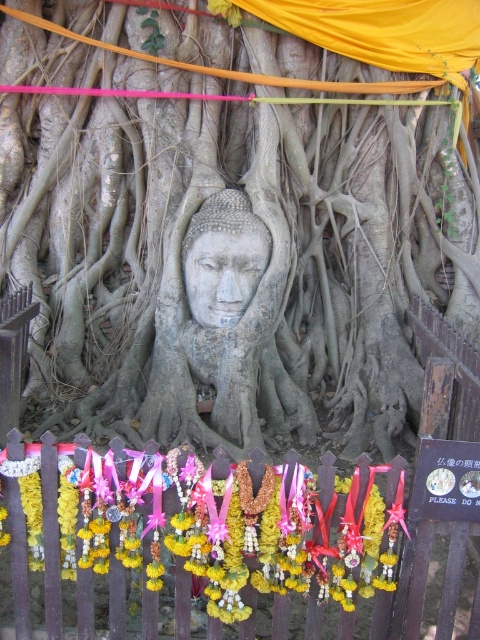
Describe the element at coordinates (180, 540) in the screenshot. The height and width of the screenshot is (640, 480). I see `yellow fabric garland at lower center` at that location.

Which of these two, yellow fabric garland at lower center or gray stone buddha head at center, stands taller?

Standing taller between the two is gray stone buddha head at center.

Is point (249, 612) positioned before point (251, 292)?

That is True.

At what (x,y) coordinates should I click in order to perform the action: click on yellow fabric garland at lower center. Please return your answer as a coordinate pair (x, y). Image resolution: width=480 pixels, height=640 pixels. Looking at the image, I should click on (180, 540).

Between gray textured roots at center and wooden picket fence at center, which one is positioned lower?

Positioned lower is wooden picket fence at center.

Does gray textured roots at center have a larger size compared to wooden picket fence at center?

Correct, gray textured roots at center is larger in size than wooden picket fence at center.

The image size is (480, 640). Describe the element at coordinates (255, 280) in the screenshot. I see `gray textured roots at center` at that location.

What are the coordinates of `gray textured roots at center` in the screenshot? It's located at (255, 280).

Which of these two, gray stone buddha head at center or gray stone head at center, stands taller?

With more height is gray stone buddha head at center.

What do you see at coordinates (215, 324) in the screenshot?
I see `gray stone buddha head at center` at bounding box center [215, 324].

The width and height of the screenshot is (480, 640). Identify the location of gray stone buddha head at center. (215, 324).

At what (x,y) coordinates should I click in order to perform the action: click on gray stone buddha head at center. Please return your answer as a coordinate pair (x, y). Looking at the image, I should click on (215, 324).